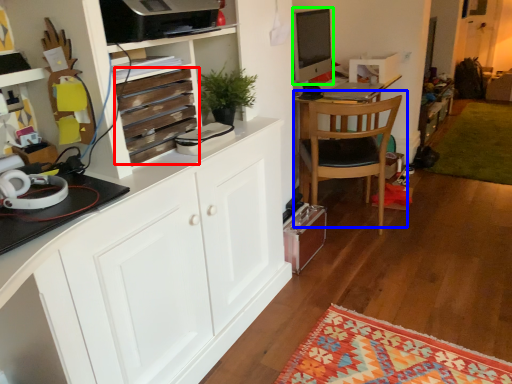
Question: Estimate the real-world distances between objects in this image. Which object is farther from drawer (highlighted by a red box), chair (highlighted by a blue box) or desktop computer (highlighted by a green box)?

Choices:
 (A) chair
 (B) desktop computer

Answer: (A)